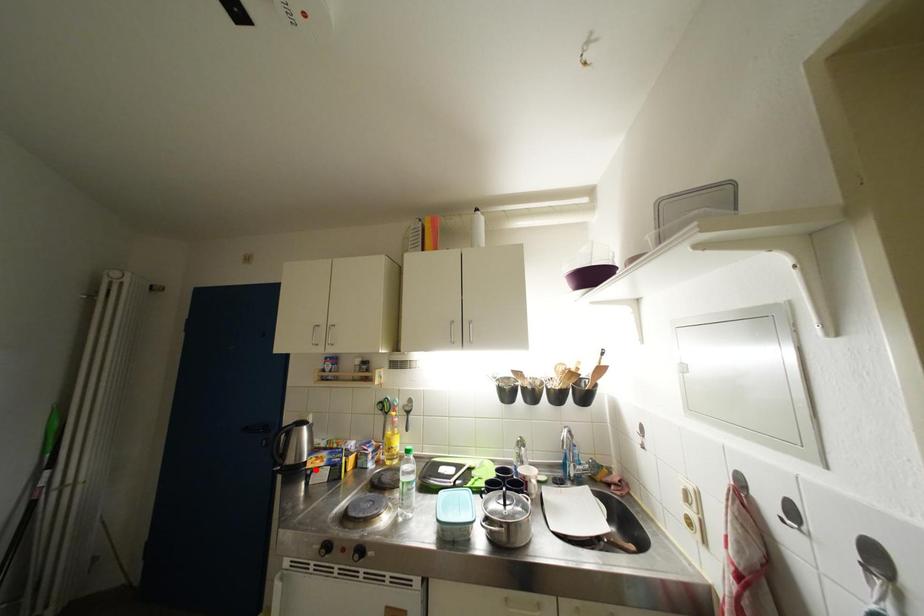
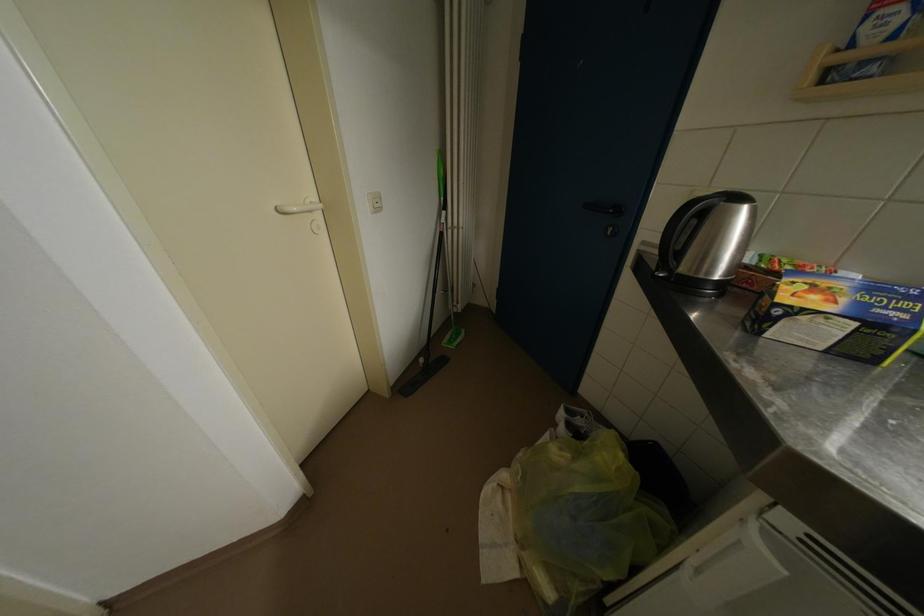
In the second image, find the point that corresponds to the highlighted location in the first image.

(791, 302)